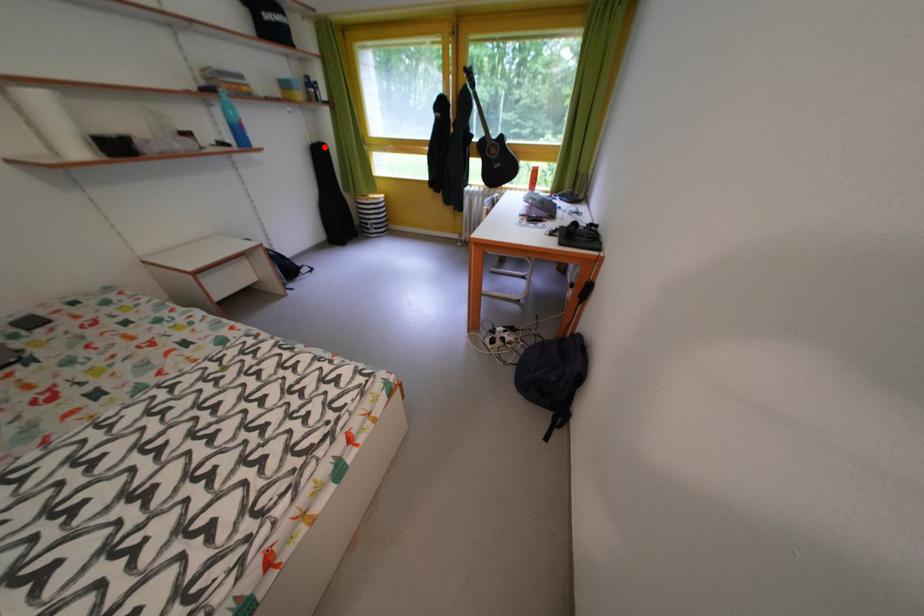
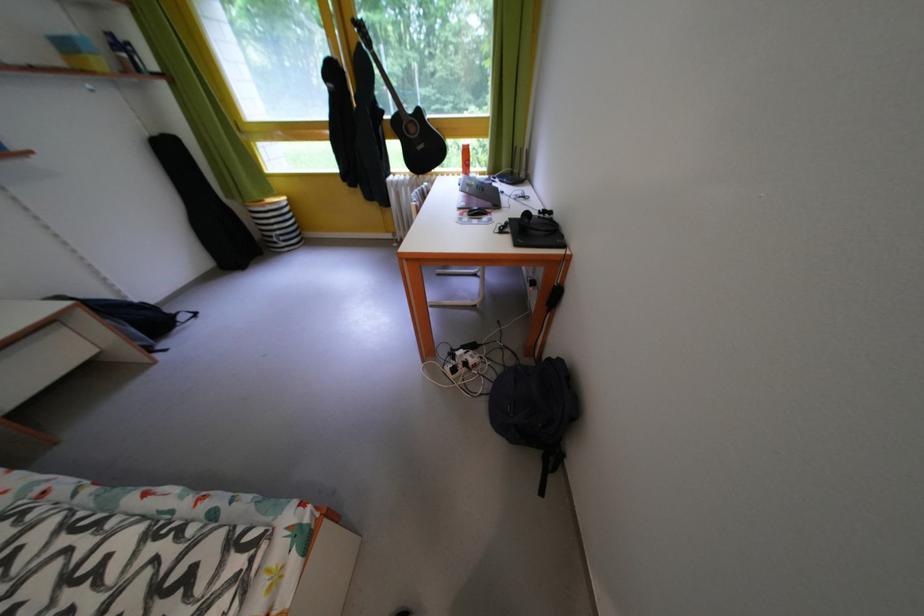
Locate, in the second image, the point that corresponds to the highlighted location in the first image.

(165, 139)